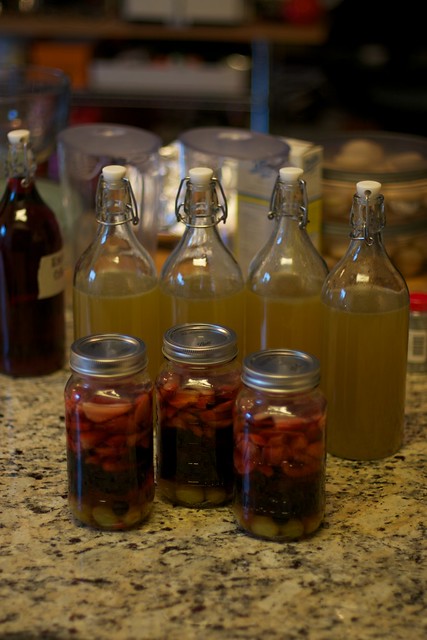
Where is `covers`? covers is located at coordinates [109, 365], [191, 354], [276, 383].